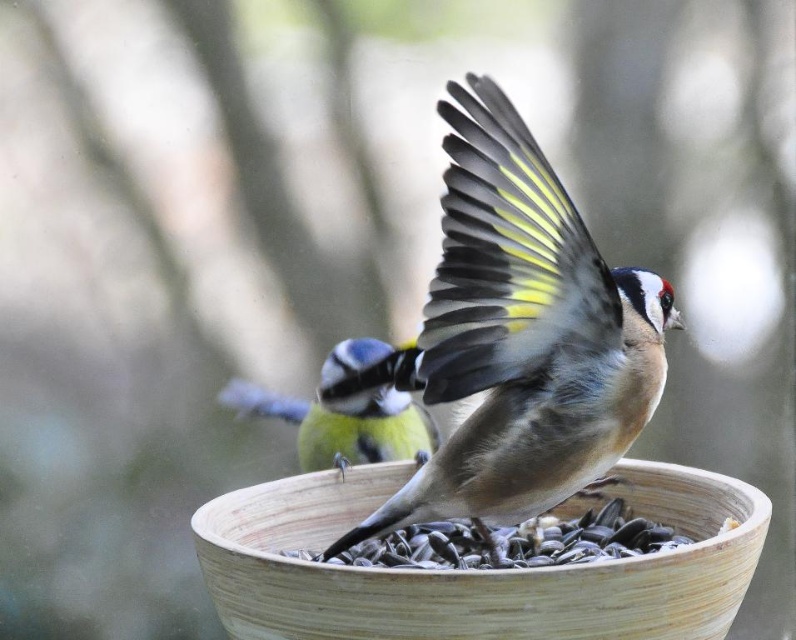
You are a birdwatcher trying to determine the positions of two points in the image. The first point is at coordinates point (488, 474) and the second is at point (313, 579). Based on the scene description, which point is closer to the viewer?

Point (313, 579) is closer to the viewer because the description states that point (488, 474) is behind point (313, 579).